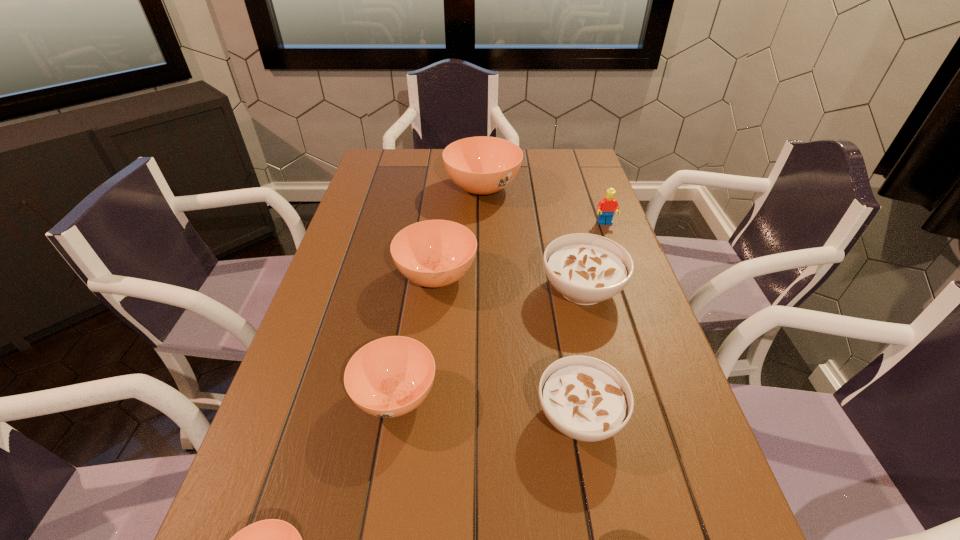
Find the location of `the farthest soup bowl`. the farthest soup bowl is located at coordinates (482, 165).

The height and width of the screenshot is (540, 960). I want to click on the tallest soup bowl, so click(x=482, y=165).

Where is `the sixth nearest object`? The height and width of the screenshot is (540, 960). the sixth nearest object is located at coordinates (607, 206).

You are a GUI agent. You are given a task and a screenshot of the screen. Output one action in this format:
    pyautogui.click(x=<x>, y=<y>)
    Task: Click on the Lego
    
    Given the screenshot: What is the action you would take?
    pyautogui.click(x=607, y=206)

Where is `the third smallest peach soup bowl`? The height and width of the screenshot is (540, 960). the third smallest peach soup bowl is located at coordinates (434, 253).

This screenshot has width=960, height=540. Identify the location of the bigger white soup bowl. pyautogui.click(x=586, y=269).

At what (x,y) coordinates should I click in order to perform the action: click on the third biggest peach soup bowl. Please return your answer as a coordinate pair (x, y). This screenshot has height=540, width=960. Looking at the image, I should click on (389, 377).

Locate an element on the screen. The width and height of the screenshot is (960, 540). the smaller white soup bowl is located at coordinates (585, 398).

Locate an element on the screen. blank area located on the left of the farthest peach soup bowl is located at coordinates (363, 188).

Image resolution: width=960 pixels, height=540 pixels. In order to click on vacant region located on the face of the second farthest object in this screenshot , I will do `click(614, 251)`.